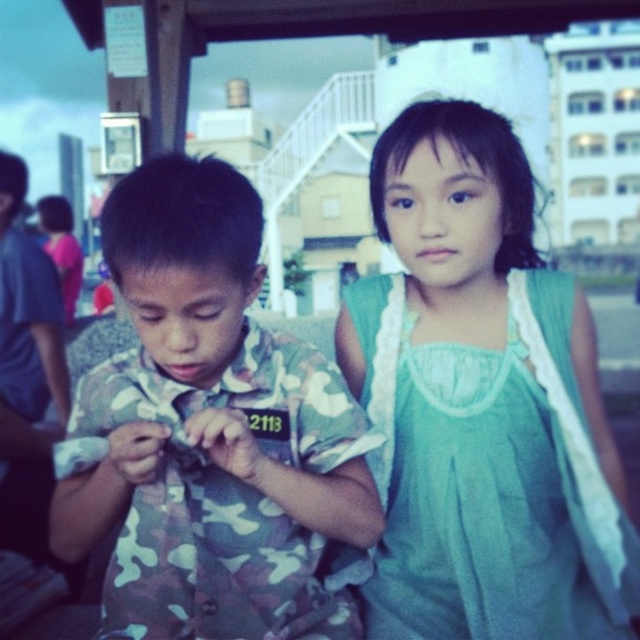
You are a photographer adjusting your camera settings to capture the two children under the wooden structure. You notice the green sheer dress at center and the camouflage fabric shirt at center. Which clothing item is closer to your camera?

The green sheer dress at center is closer to the camera because it is further to the viewer than the camouflage fabric shirt at center.

You are a photographer trying to capture a clear shot of both the green sheer dress at center and the camouflage fabric shirt at center. Since the camera can only focus on one object at a time, which object should you choose to ensure it appears larger in the photo?

The green sheer dress at center is larger in size than the camouflage fabric shirt at center, so to ensure the object appears larger in the photo, you should choose the green sheer dress at center.